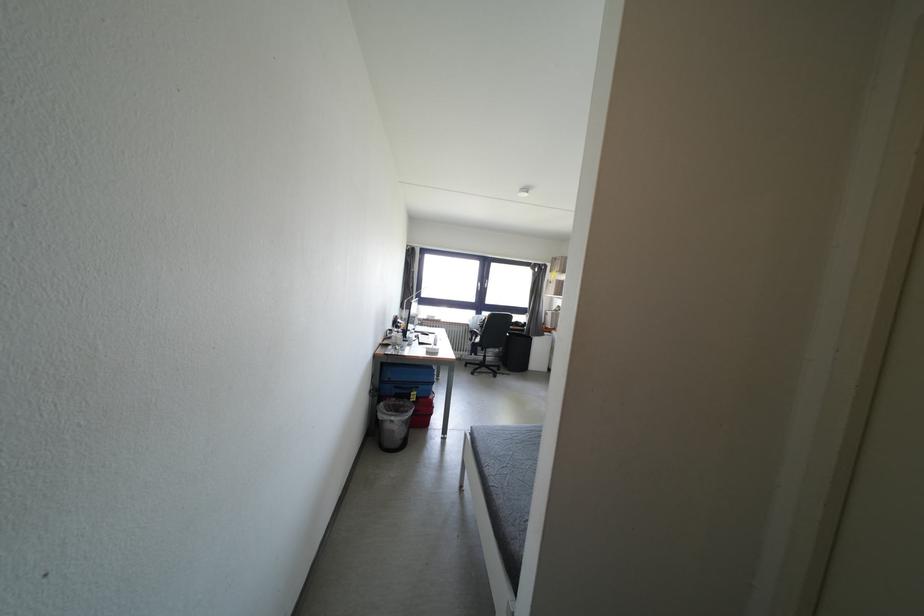
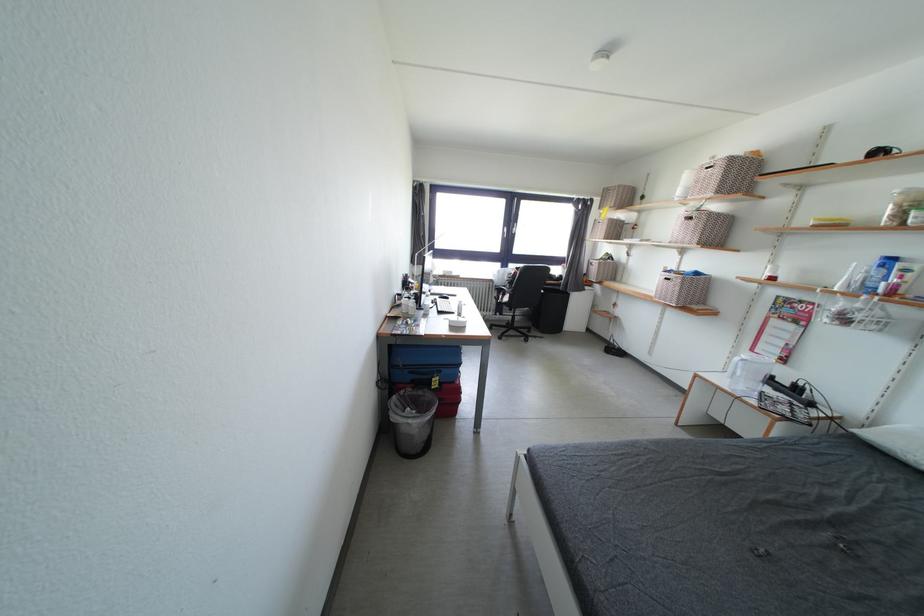
In the second image, find the point that corresponds to (x=488, y=331) in the first image.

(517, 286)